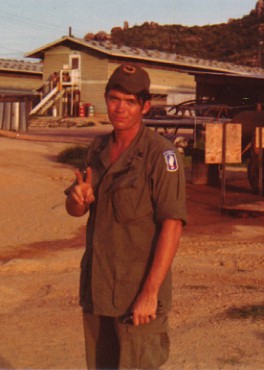
Locate an element on the screen. The width and height of the screenshot is (264, 370). stairs is located at coordinates (46, 102).